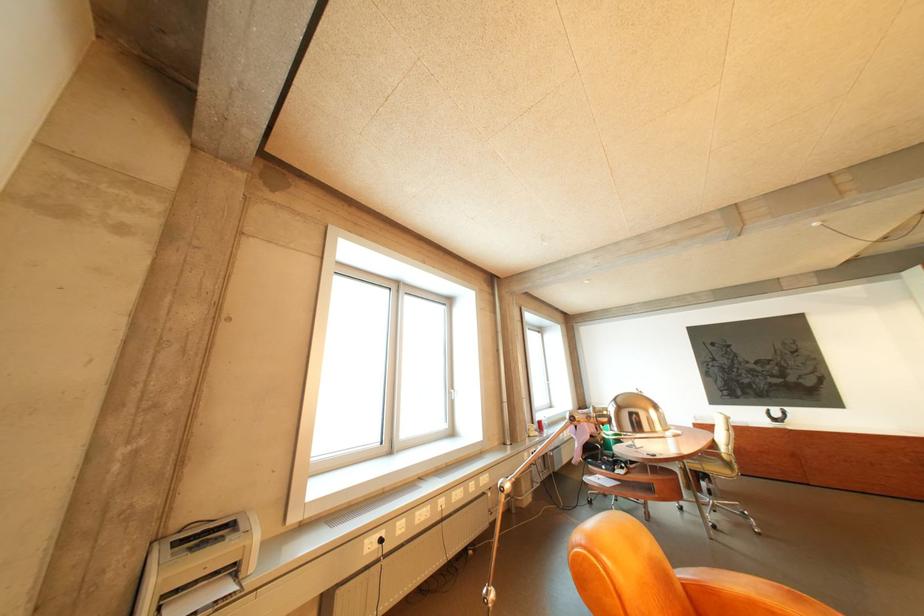
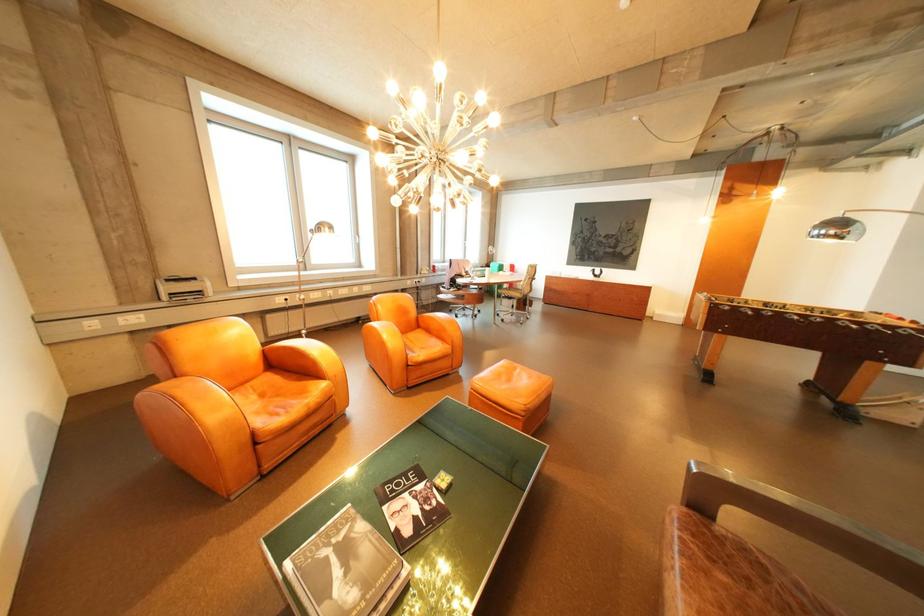
In the second image, find the point that corresponds to (x=601, y=438) in the first image.

(467, 276)